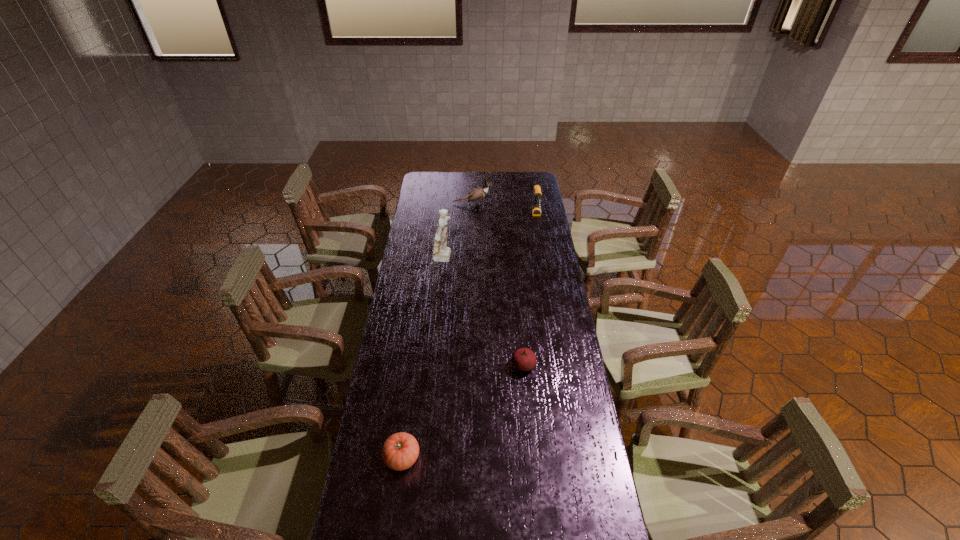
Find the location of a particular element. This screenshot has width=960, height=540. vacant area at the far left corner of the desktop is located at coordinates (442, 192).

Find the location of a particular element. free area in between the bird and the third nearest object is located at coordinates (459, 231).

In order to click on unoccupied position between the nearer tomato and the bird in this screenshot , I will do `click(437, 330)`.

Image resolution: width=960 pixels, height=540 pixels. In order to click on free spot between the bird and the nearest object in this screenshot , I will do [x=437, y=330].

Find the location of a particular element. Image resolution: width=960 pixels, height=540 pixels. vacant space that is in between the bird and the nearest object is located at coordinates (437, 330).

Locate an element on the screen. free point between the bird and the rightmost object is located at coordinates (504, 211).

This screenshot has height=540, width=960. In order to click on vacant space that is in between the nearer tomato and the bird in this screenshot , I will do click(x=437, y=330).

The image size is (960, 540). Identify the location of free space between the tallest object and the right tomato. (484, 312).

Image resolution: width=960 pixels, height=540 pixels. In order to click on free spot between the fourth object from left to right and the left tomato in this screenshot , I will do `click(463, 411)`.

Locate an element on the screen. The height and width of the screenshot is (540, 960). unoccupied area between the bird and the farther tomato is located at coordinates (497, 285).